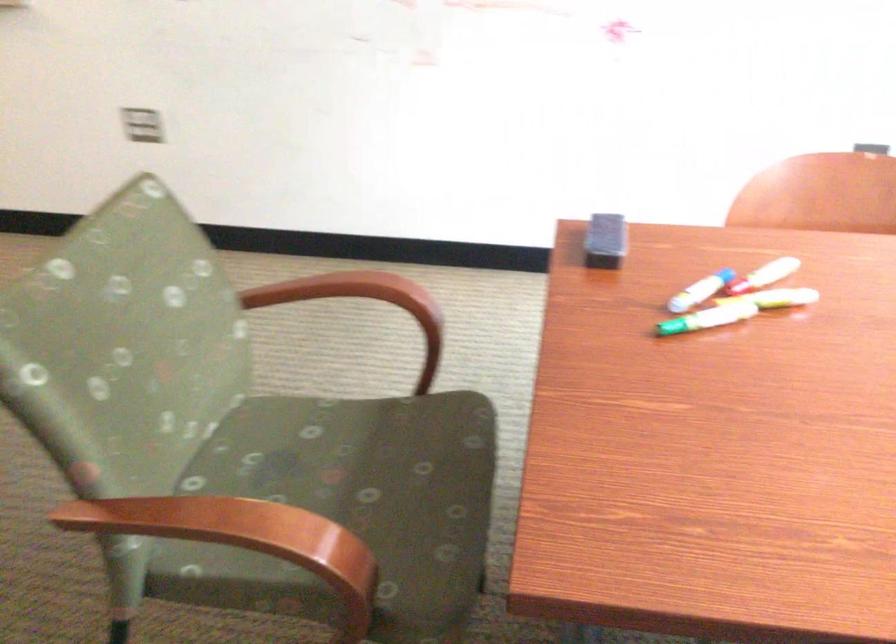
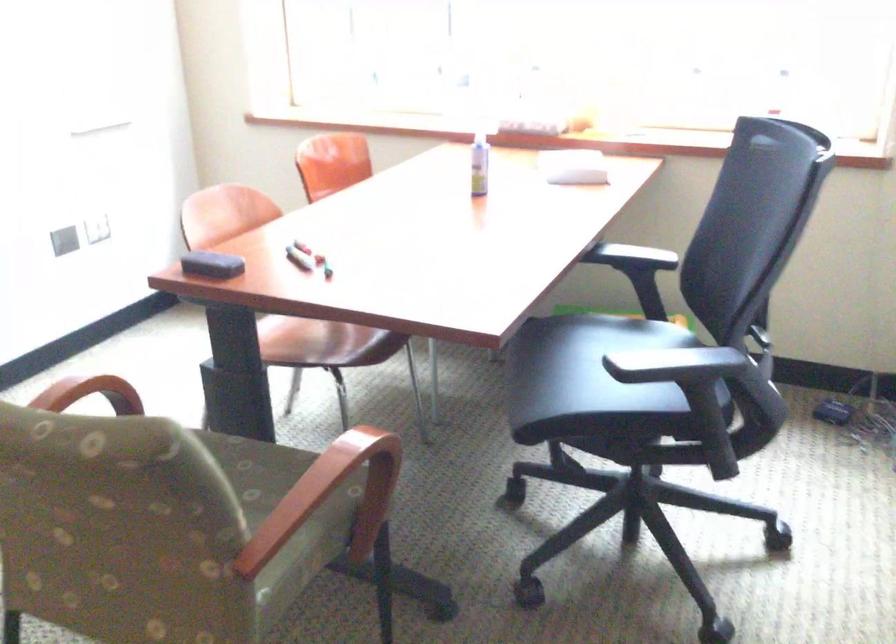
The point at [591,239] is marked in the first image. Where is the corresponding point in the second image?

(211, 265)